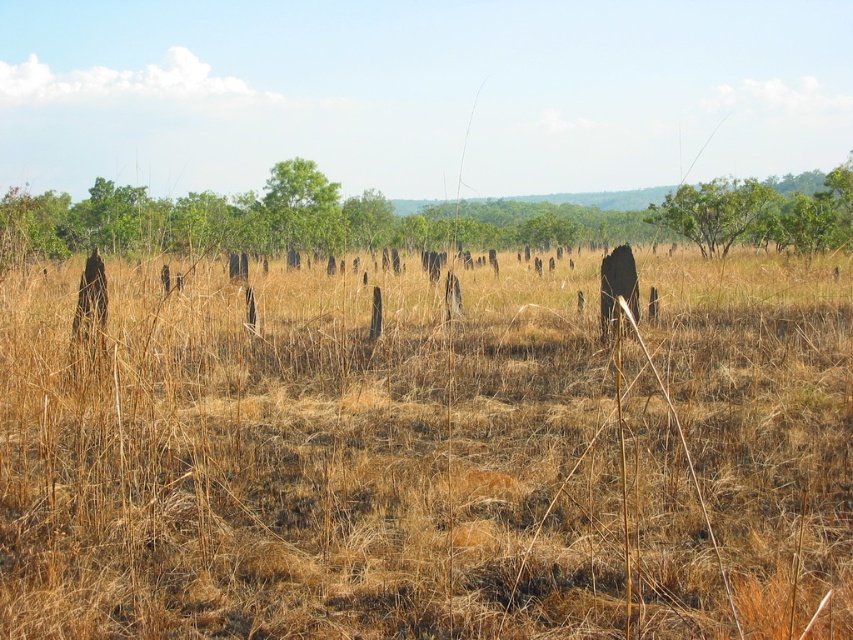
Question: Can you confirm if brown dry grass at center is bigger than green leafy tree at upper right?

Choices:
 (A) no
 (B) yes

Answer: (B)

Question: Among these points, which one is farthest from the camera?

Choices:
 (A) pyautogui.click(x=737, y=209)
 (B) pyautogui.click(x=805, y=376)

Answer: (A)

Question: Where is brown dry grass at center located in relation to brown wood tree at center in the image?

Choices:
 (A) right
 (B) left

Answer: (A)

Question: Can you confirm if brown wood tree at center is wider than green matte tree at upper center?

Choices:
 (A) yes
 (B) no

Answer: (A)

Question: Which object is the farthest from the green matte tree at upper center?

Choices:
 (A) brown dry grass at center
 (B) brown wood tree at center

Answer: (A)

Question: Which object is farther from the camera taking this photo?

Choices:
 (A) green leafy tree at upper right
 (B) brown wood tree at center
 (C) green matte tree at upper center
 (D) brown dry grass at center

Answer: (C)